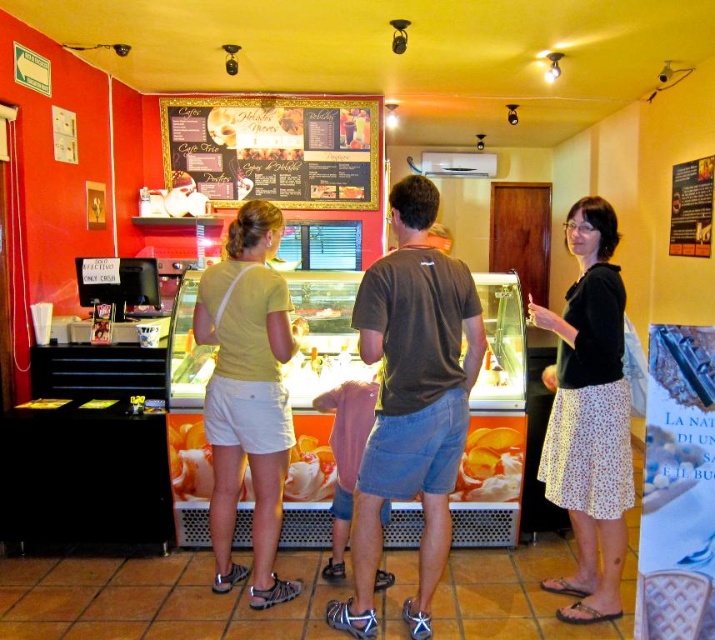
You are standing in the middle of the room and want to place a new menu board. Where should you position it so that it doesn not block the light beige shorts at center?

The light beige shorts at center is located at point (247, 394), so you should position the new menu board away from that coordinate to avoid blocking it.